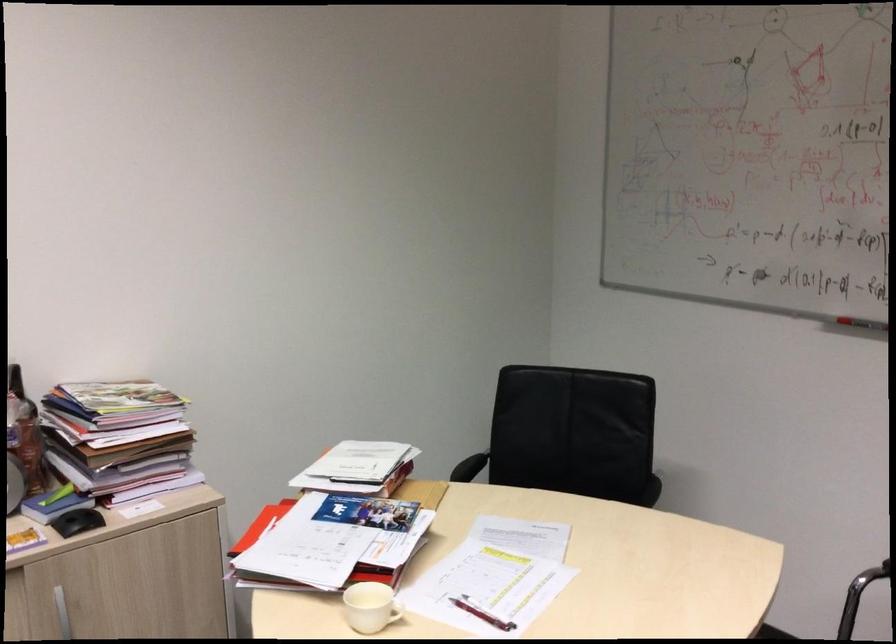
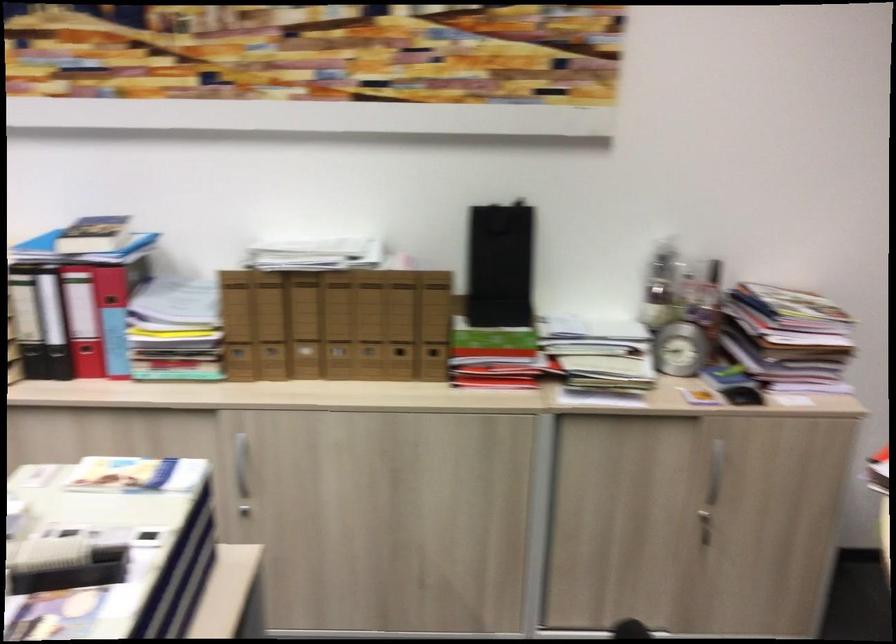
Question: Based on the continuous images, in which direction is the camera rotating? Reply with the corresponding letter.

Choices:
 (A) Left
 (B) Right
 (C) Up
 (D) Down

Answer: (A)